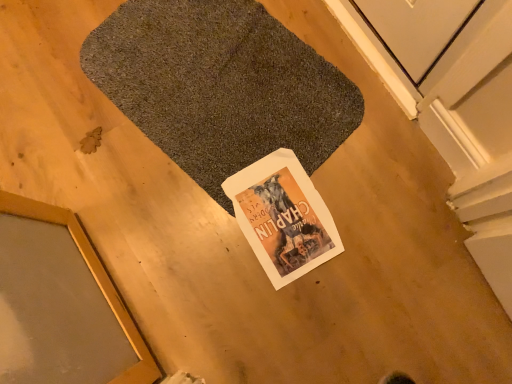
Measure the distance between point (211,155) and camera.

A distance of 1.06 meters exists between point (211,155) and camera.

What do you see at coordinates (283, 217) in the screenshot? The image size is (512, 384). I see `white paper magazine at center` at bounding box center [283, 217].

Find the location of a particular element. The width and height of the screenshot is (512, 384). gold-framed mirror at lower left is located at coordinates (94, 278).

You are a GUI agent. You are given a task and a screenshot of the screen. Output one action in this format:
    pyautogui.click(x=<x>, y=<y>)
    Task: Click on the dark gray carpet at center
    The image size is (512, 384).
    Given the screenshot: What is the action you would take?
    tap(220, 86)

Would you say dark gray carpet at center is to the left or to the right of white paper magazine at center in the picture?

In the image, dark gray carpet at center appears on the left side of white paper magazine at center.

Between dark gray carpet at center and white paper magazine at center, which one is positioned behind?

white paper magazine at center is further away from the camera.

Which is farther from the camera, (x=244, y=48) or (x=270, y=250)?

The point (x=244, y=48) is farther.

Who is taller, dark gray carpet at center or white paper magazine at center?

With more height is dark gray carpet at center.

Is point (258, 132) more distant than point (119, 379)?

Yes, it is.

Is dark gray carpet at center shorter than gold-framed mirror at lower left?

Yes.

Is dark gray carpet at center to the left or to the right of gold-framed mirror at lower left in the image?

dark gray carpet at center is positioned on gold-framed mirror at lower left's right side.

Is the depth of gold-framed mirror at lower left greater than that of dark gray carpet at center?

That is False.

The width and height of the screenshot is (512, 384). I want to click on bath mat below the gold-framed mirror at lower left (from a real-world perspective), so click(220, 86).

Are gold-framed mirror at lower left and dark gray carpet at center beside each other?

No.

Is gold-framed mirror at lower left oriented away from dark gray carpet at center?

No, gold-framed mirror at lower left is not facing the opposite direction of dark gray carpet at center.

Which of these two, white paper magazine at center or gold-framed mirror at lower left, is bigger?

gold-framed mirror at lower left.

Measure the distance from white paper magazine at center to gold-framed mirror at lower left.

15.73 inches.

Between white paper magazine at center and gold-framed mirror at lower left, which one has smaller width?

Thinner between the two is white paper magazine at center.

Considering the positions of objects white paper magazine at center and gold-framed mirror at lower left in the image provided, who is in front, white paper magazine at center or gold-framed mirror at lower left?

Positioned in front is gold-framed mirror at lower left.

Is point (271, 242) closer or farther from the camera than point (131, 36)?

Point (271, 242) is closer to the camera than point (131, 36).

Can you see white paper magazine at center touching dark gray carpet at center?

white paper magazine at center and dark gray carpet at center are clearly separated.

Can you tell me how much white paper magazine at center and dark gray carpet at center differ in facing direction?

105 degrees.

From the image's perspective, is white paper magazine at center located above or below dark gray carpet at center?

Clearly, from the image's perspective, white paper magazine at center is below dark gray carpet at center.

Is gold-framed mirror at lower left positioned with its back to white paper magazine at center?

gold-framed mirror at lower left is not turned away from white paper magazine at center.

Looking at this image, what's the angular difference between gold-framed mirror at lower left and white paper magazine at center's facing directions?

There is a 88.1-degree angle between the facing directions of gold-framed mirror at lower left and white paper magazine at center.

From the image's perspective, is gold-framed mirror at lower left below white paper magazine at center?

Yes, from the image's perspective, gold-framed mirror at lower left is beneath white paper magazine at center.

You are a GUI agent. You are given a task and a screenshot of the screen. Output one action in this format:
    pyautogui.click(x=<x>, y=<y>)
    Task: Click on the bath mat that is above the white paper magazine at center (from the image's perspective)
    This screenshot has height=384, width=512.
    Given the screenshot: What is the action you would take?
    pyautogui.click(x=220, y=86)

At what (x,y) coordinates should I click in order to perform the action: click on bath mat located underneath the gold-framed mirror at lower left (from a real-world perspective). Please return your answer as a coordinate pair (x, y). This screenshot has height=384, width=512. Looking at the image, I should click on (220, 86).

Which object lies further to the anchor point dark gray carpet at center, white paper magazine at center or gold-framed mirror at lower left?

gold-framed mirror at lower left.

Estimate the real-world distances between objects in this image. Which object is further from white paper magazine at center, gold-framed mirror at lower left or dark gray carpet at center?

gold-framed mirror at lower left is further to white paper magazine at center.

From the image, which object appears to be farther from gold-framed mirror at lower left, dark gray carpet at center or white paper magazine at center?

dark gray carpet at center is further to gold-framed mirror at lower left.

Estimate the real-world distances between objects in this image. Which object is closer to white paper magazine at center, dark gray carpet at center or gold-framed mirror at lower left?

dark gray carpet at center is positioned closer to the anchor white paper magazine at center.

Based on their spatial positions, is gold-framed mirror at lower left or white paper magazine at center closer to dark gray carpet at center?

Among the two, white paper magazine at center is located nearer to dark gray carpet at center.

Estimate the real-world distances between objects in this image. Which object is closer to gold-framed mirror at lower left, white paper magazine at center or dark gray carpet at center?

white paper magazine at center lies closer to gold-framed mirror at lower left than the other object.

Find the location of a particular element. The image size is (512, 384). bath mat located between gold-framed mirror at lower left and white paper magazine at center in the depth direction is located at coordinates (220, 86).